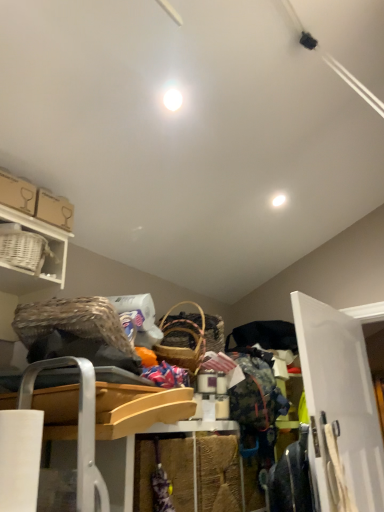
Where is `floral fabric dress at lower right`? floral fabric dress at lower right is located at coordinates (292, 478).

Image resolution: width=384 pixels, height=512 pixels. What do you see at coordinates (172, 99) in the screenshot?
I see `white glossy light bulb at center, which is the 2th light from right to left` at bounding box center [172, 99].

I want to click on white wood door at right, so click(339, 407).

In the scene shown: Which is further, (172, 96) or (320, 487)?

The point (320, 487) is more distant.

I want to click on light in front of the white wood door at right, so click(x=172, y=99).

From the image's perspective, is white glossy light bulb at center, positioned as the 1th light in top-to-bottom order, positioned above or below white wood door at right?

white glossy light bulb at center, positioned as the 1th light in top-to-bottom order, is situated higher than white wood door at right in the image.

Would you say white glossy light bulb at center, which ranks as the first light in front-to-back order, is outside white wood door at right?

Yes.

Identify the location of light located behind the floral fabric dress at lower right. The image size is (384, 512). (279, 200).

Between floral fabric dress at lower right and white glossy light fixture at upper center, the 1th light positioned from the back, which one has less height?

With less height is white glossy light fixture at upper center, the 1th light positioned from the back.

Does floral fabric dress at lower right contain white glossy light fixture at upper center, the 1th light positioned from the back?

No, white glossy light fixture at upper center, the 1th light positioned from the back, is not a part of floral fabric dress at lower right.

Between point (273, 499) and point (280, 193), which one is positioned in front?

The point (273, 499) is closer to the camera.

Is white wood door at right in front of or behind white glossy light fixture at upper center, the 2th light in the front-to-back sequence, in the image?

Visually, white wood door at right is located in front of white glossy light fixture at upper center, the 2th light in the front-to-back sequence.

Is white wood door at right located outside white glossy light fixture at upper center, positioned as the 2th light in left-to-right order?

Absolutely, white wood door at right is external to white glossy light fixture at upper center, positioned as the 2th light in left-to-right order.

Can you confirm if white wood door at right is shorter than white glossy light fixture at upper center, which ranks as the 1th light in bottom-to-top order?

No, white wood door at right is not shorter than white glossy light fixture at upper center, which ranks as the 1th light in bottom-to-top order.

Can you tell me how much white wood door at right and white glossy light fixture at upper center, the 2th light in the front-to-back sequence, differ in facing direction?

white wood door at right and white glossy light fixture at upper center, the 2th light in the front-to-back sequence, are facing 90 degrees away from each other.

In the scene shown: Can you confirm if white glossy light fixture at upper center, marked as the 2th light in a top-to-bottom arrangement, is bigger than white wicker basket at upper left?

Incorrect, white glossy light fixture at upper center, marked as the 2th light in a top-to-bottom arrangement, is not larger than white wicker basket at upper left.

From the image's perspective, is white glossy light fixture at upper center, marked as the 2th light in a top-to-bottom arrangement, above or below white wicker basket at upper left?

white glossy light fixture at upper center, marked as the 2th light in a top-to-bottom arrangement, is situated higher than white wicker basket at upper left in the image.

Considering the relative sizes of white glossy light fixture at upper center, the 1th light positioned from the back, and white wicker basket at upper left in the image provided, is white glossy light fixture at upper center, the 1th light positioned from the back, shorter than white wicker basket at upper left?

Yes, white glossy light fixture at upper center, the 1th light positioned from the back, is shorter than white wicker basket at upper left.

Does white glossy light fixture at upper center, the 1th light positioned from the back, turn towards white wicker basket at upper left?

No, white glossy light fixture at upper center, the 1th light positioned from the back, is not turned towards white wicker basket at upper left.

Does white glossy light fixture at upper center, which ranks as the 1th light in bottom-to-top order, turn towards floral fabric dress at lower right?

No, white glossy light fixture at upper center, which ranks as the 1th light in bottom-to-top order, is not oriented towards floral fabric dress at lower right.

Is white glossy light fixture at upper center, which ranks as the 1th light in bottom-to-top order, closer to camera compared to floral fabric dress at lower right?

No, white glossy light fixture at upper center, which ranks as the 1th light in bottom-to-top order, is further to the viewer.

Identify the location of clothing to the left of white glossy light fixture at upper center, the 1th light positioned from the back. The height and width of the screenshot is (512, 384). (292, 478).

From the image's perspective, is white glossy light fixture at upper center, the 1th light positioned from the back, under floral fabric dress at lower right?

Actually, white glossy light fixture at upper center, the 1th light positioned from the back, appears above floral fabric dress at lower right in the image.

Who is taller, white wood door at right or white wicker basket at upper left?

With more height is white wood door at right.

Where is `door below the white wicker basket at upper left (from a real-world perspective)`? The width and height of the screenshot is (384, 512). door below the white wicker basket at upper left (from a real-world perspective) is located at coordinates (339, 407).

Based on the photo, considering the sizes of objects white wood door at right and white wicker basket at upper left in the image provided, who is thinner, white wood door at right or white wicker basket at upper left?

white wood door at right is thinner.

From a real-world perspective, which object rests below the other?

white wicker basket at upper left, from a real-world perspective.

Measure the distance from white wicker basket at upper left to white glossy light bulb at center, the 2th light ordered from the bottom.

white wicker basket at upper left is 72.02 centimeters away from white glossy light bulb at center, the 2th light ordered from the bottom.

Can you tell me how much white wicker basket at upper left and white glossy light bulb at center, positioned as the 1th light in top-to-bottom order, differ in facing direction?

83.5 degrees.

Which point is more distant from viewer, (48,229) or (178,101)?

The point (48,229) is farther.

Which light is the 2nd one when counting from the left side of the white wood door at right? Please provide its 2D coordinates.

[(172, 99)]

You are a GUI agent. You are given a task and a screenshot of the screen. Output one action in this format:
    pyautogui.click(x=<x>, y=<y>)
    Task: Click on the clothing beneath the white glossy light fixture at upper center, which ranks as the 1th light in bottom-to-top order (from a real-world perspective)
    
    Given the screenshot: What is the action you would take?
    pyautogui.click(x=292, y=478)

When comparing their distances from white wicker basket at upper left, does white glossy light fixture at upper center, which ranks as the 1th light in right-to-left order, or floral fabric dress at lower right seem further?

white glossy light fixture at upper center, which ranks as the 1th light in right-to-left order, is further to white wicker basket at upper left.

When comparing their distances from white glossy light fixture at upper center, which ranks as the 1th light in bottom-to-top order, does floral fabric dress at lower right or white wood door at right seem closer?

white wood door at right is closer to white glossy light fixture at upper center, which ranks as the 1th light in bottom-to-top order.

Which object lies nearer to the anchor point white wood door at right, white glossy light fixture at upper center, the 2th light in the front-to-back sequence, or floral fabric dress at lower right?

floral fabric dress at lower right is positioned closer to the anchor white wood door at right.

From the image, which object appears to be farther from floral fabric dress at lower right, white wood door at right or white glossy light bulb at center, marked as the second light in a back-to-front arrangement?

Based on the image, white glossy light bulb at center, marked as the second light in a back-to-front arrangement, appears to be further to floral fabric dress at lower right.

Based on their spatial positions, is white glossy light bulb at center, arranged as the first light when viewed from the left, or white glossy light fixture at upper center, the 2th light in the front-to-back sequence, further from white wood door at right?

white glossy light bulb at center, arranged as the first light when viewed from the left, lies further to white wood door at right than the other object.

Which object lies further to the anchor point white glossy light bulb at center, positioned as the 1th light in top-to-bottom order, white glossy light fixture at upper center, the 1th light positioned from the back, or white wicker basket at upper left?

white glossy light fixture at upper center, the 1th light positioned from the back, lies further to white glossy light bulb at center, positioned as the 1th light in top-to-bottom order, than the other object.

When comparing their distances from white glossy light fixture at upper center, marked as the 2th light in a top-to-bottom arrangement, does white wood door at right or white wicker basket at upper left seem closer?

white wood door at right lies closer to white glossy light fixture at upper center, marked as the 2th light in a top-to-bottom arrangement, than the other object.

Which object lies nearer to the anchor point floral fabric dress at lower right, white glossy light fixture at upper center, positioned as the 2th light in left-to-right order, or white wicker basket at upper left?

Based on the image, white wicker basket at upper left appears to be nearer to floral fabric dress at lower right.

This screenshot has width=384, height=512. I want to click on door between white glossy light bulb at center, positioned as the 1th light in top-to-bottom order, and floral fabric dress at lower right, in the vertical direction, so click(x=339, y=407).

Where is `light between white glossy light bulb at center, arranged as the first light when viewed from the left, and white wood door at right, in the vertical direction`? light between white glossy light bulb at center, arranged as the first light when viewed from the left, and white wood door at right, in the vertical direction is located at coordinates (279, 200).

The width and height of the screenshot is (384, 512). In order to click on clothing situated between white wicker basket at upper left and white wood door at right from left to right in this screenshot , I will do `click(292, 478)`.

Locate an element on the screen. The width and height of the screenshot is (384, 512). shelf between white glossy light bulb at center, marked as the second light in a back-to-front arrangement, and floral fabric dress at lower right in the up-down direction is located at coordinates (45, 258).